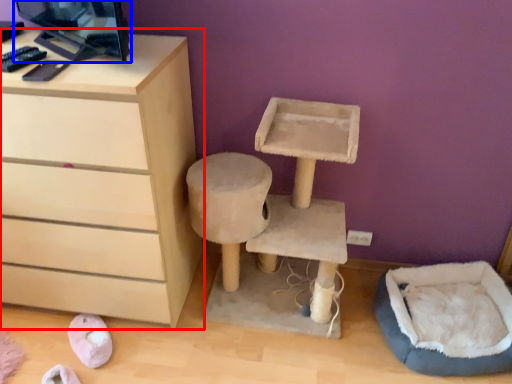
Question: Among these objects, which one is farthest to the camera, chest of drawers (highlighted by a red box) or desktop computer (highlighted by a blue box)?

Choices:
 (A) chest of drawers
 (B) desktop computer

Answer: (A)